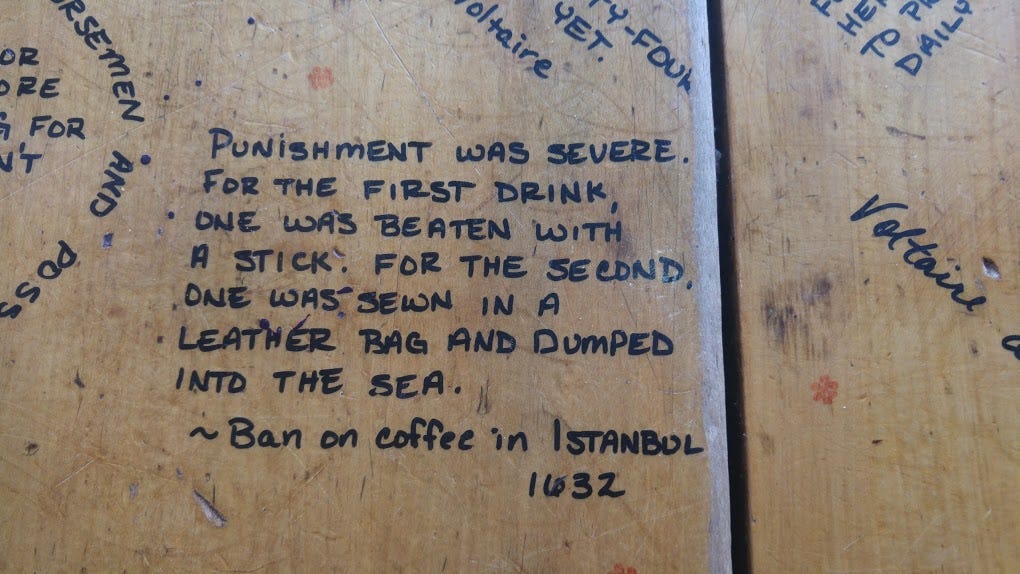
Locate an element on the screen. The height and width of the screenshot is (574, 1020). wood surface is located at coordinates pos(851,294).